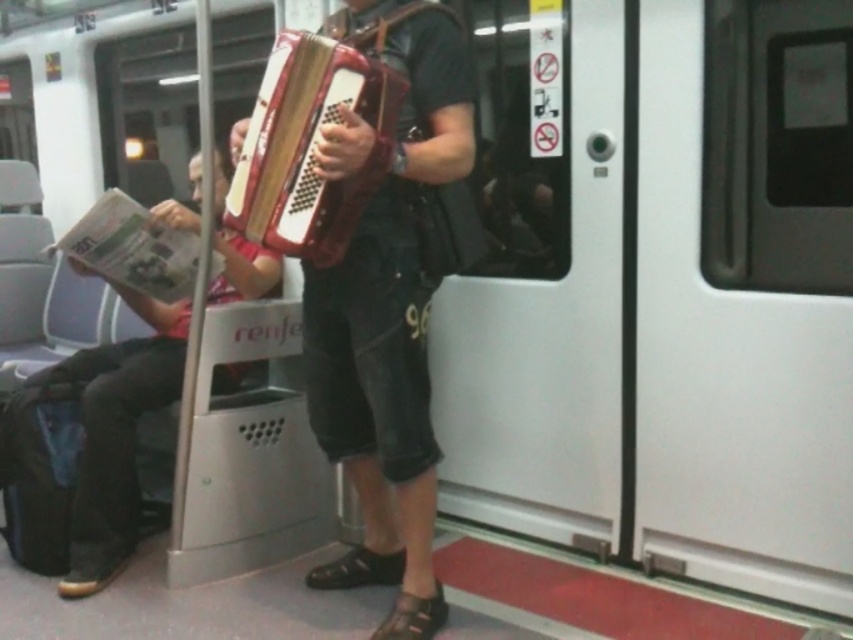
I want to click on matte red accordion at center, so click(115, 433).

Is point (120, 563) positioned behind point (384, 122)?

Yes, point (120, 563) is farther from viewer.

You are a GUI agent. You are given a task and a screenshot of the screen. Output one action in this format:
    pyautogui.click(x=<x>, y=<y>)
    Task: Click on the matte red accordion at center
    This screenshot has width=853, height=640.
    Given the screenshot: What is the action you would take?
    pos(115,433)

Is wooden accordion at center to the left of matte red accordion at center from the viewer's perspective?

No, wooden accordion at center is not to the left of matte red accordion at center.

Locate an element on the screen. This screenshot has height=640, width=853. wooden accordion at center is located at coordinates (395, 326).

Which is in front, point (451, 84) or point (340, 224)?

Point (340, 224)

Does point (387, 428) come behind point (306, 236)?

Yes, it is behind point (306, 236).

Is point (372, 42) closer to camera compared to point (265, 124)?

No.

I want to click on wooden accordion at center, so click(395, 326).